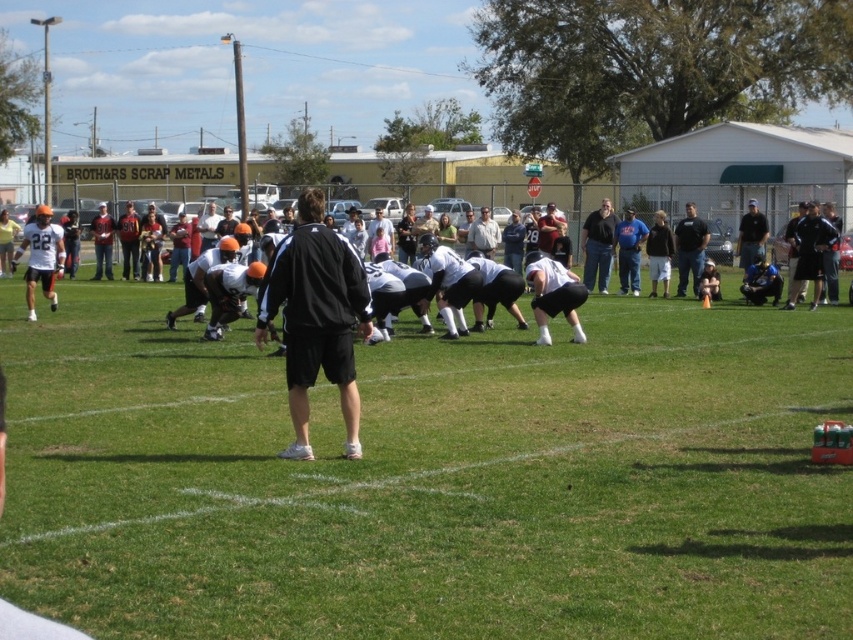
Between point (589, 260) and point (485, 225), which one is positioned behind?

Positioned behind is point (485, 225).

Does black matte shirt at center have a greater width compared to light gray fabric shirt at center?

Yes.

Who is more forward, (590, 259) or (490, 237)?

Point (590, 259)

Where is `black matte shirt at center`? The image size is (853, 640). black matte shirt at center is located at coordinates (598, 244).

Between dark gray shirt at right and light gray fabric shirt at center, which one has more height?

With more height is dark gray shirt at right.

Is dark gray shirt at right positioned before light gray fabric shirt at center?

Yes, dark gray shirt at right is closer to the viewer.

Who is more distant from viewer, [682,259] or [492,224]?

The point [492,224] is behind.

In order to click on dark gray shirt at right in this screenshot , I will do `click(689, 248)`.

Can you confirm if black matte jacket at center is positioned above dark blue shirt at center?

Actually, black matte jacket at center is below dark blue shirt at center.

Is black matte jacket at center below dark blue shirt at center?

Yes.

The height and width of the screenshot is (640, 853). I want to click on black matte jacket at center, so click(315, 317).